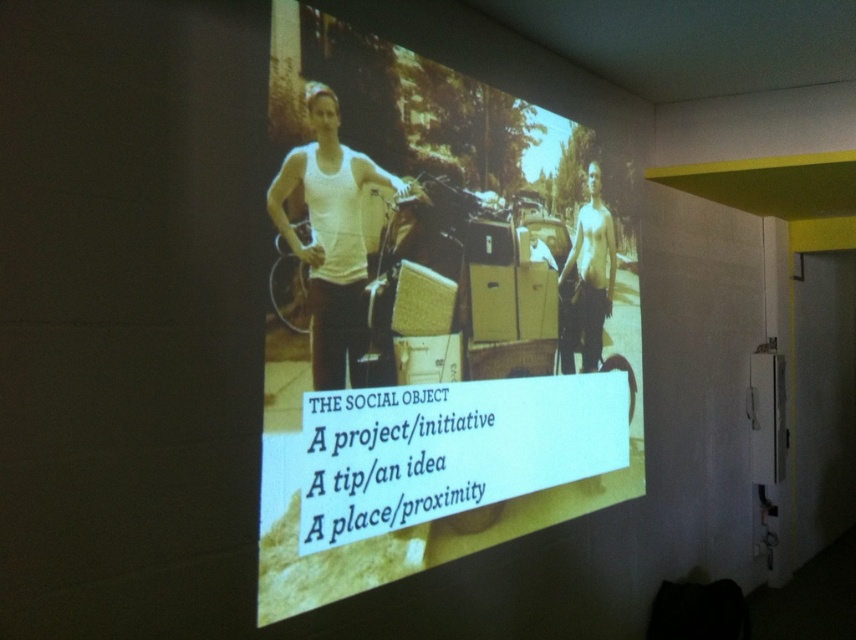
Does yellowish cardboard boxes at center have a lesser width compared to white matte tank top at center?

Incorrect, yellowish cardboard boxes at center's width is not less than white matte tank top at center's.

Looking at this image, does yellowish cardboard boxes at center appear on the left side of white matte tank top at center?

In fact, yellowish cardboard boxes at center is to the right of white matte tank top at center.

Find the location of a particular element. yellowish cardboard boxes at center is located at coordinates (432, 317).

The width and height of the screenshot is (856, 640). In order to click on yellowish cardboard boxes at center in this screenshot , I will do `click(432, 317)`.

Which of these two, white matte tank top at center or shiny metallic man at center, stands shorter?

white matte tank top at center

In the scene shown: Can you confirm if white matte tank top at center is taller than shiny metallic man at center?

Incorrect, white matte tank top at center's height is not larger of shiny metallic man at center's.

The width and height of the screenshot is (856, 640). What do you see at coordinates (331, 236) in the screenshot?
I see `white matte tank top at center` at bounding box center [331, 236].

Image resolution: width=856 pixels, height=640 pixels. I want to click on white matte tank top at center, so click(331, 236).

Consider the image. Is yellowish cardboard boxes at center wider than shiny metallic man at center?

Indeed, yellowish cardboard boxes at center has a greater width compared to shiny metallic man at center.

From the picture: Can you confirm if yellowish cardboard boxes at center is smaller than shiny metallic man at center?

Incorrect, yellowish cardboard boxes at center is not smaller in size than shiny metallic man at center.

Measure the distance between point (x=277, y=538) and camera.

The distance of point (x=277, y=538) from camera is 2.05 meters.

Image resolution: width=856 pixels, height=640 pixels. I want to click on yellowish cardboard boxes at center, so tap(432, 317).